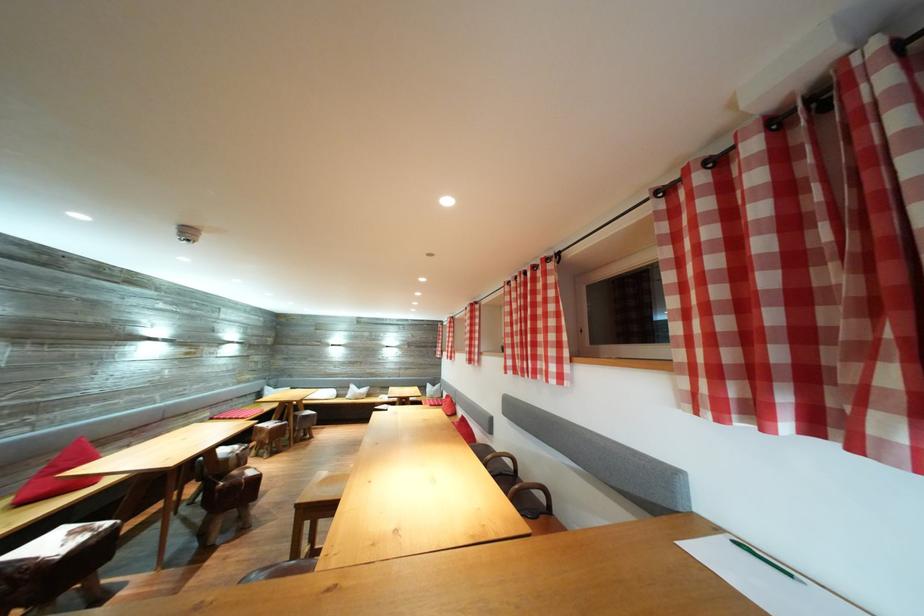
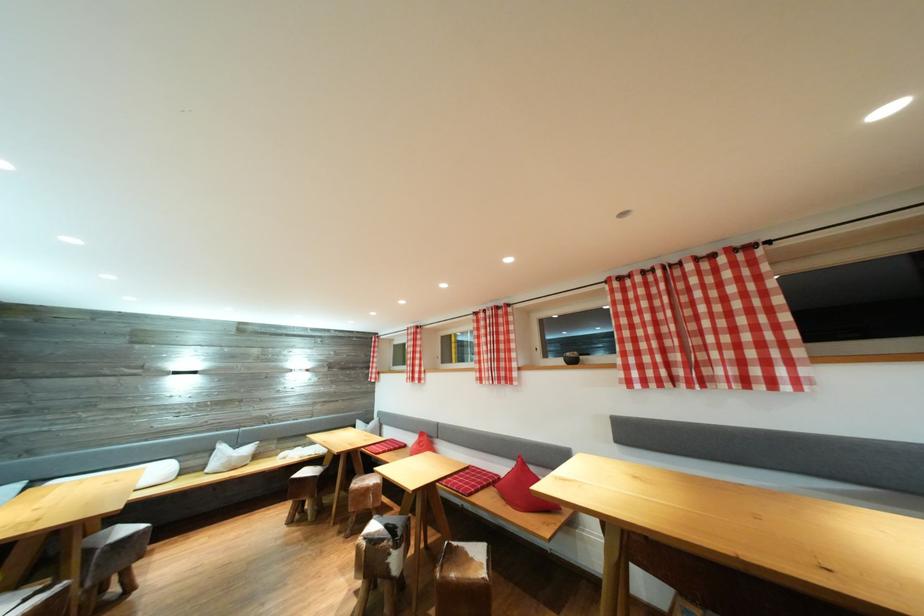
Locate, in the second image, the point that corresponds to point (443, 352) in the first image.

(375, 373)